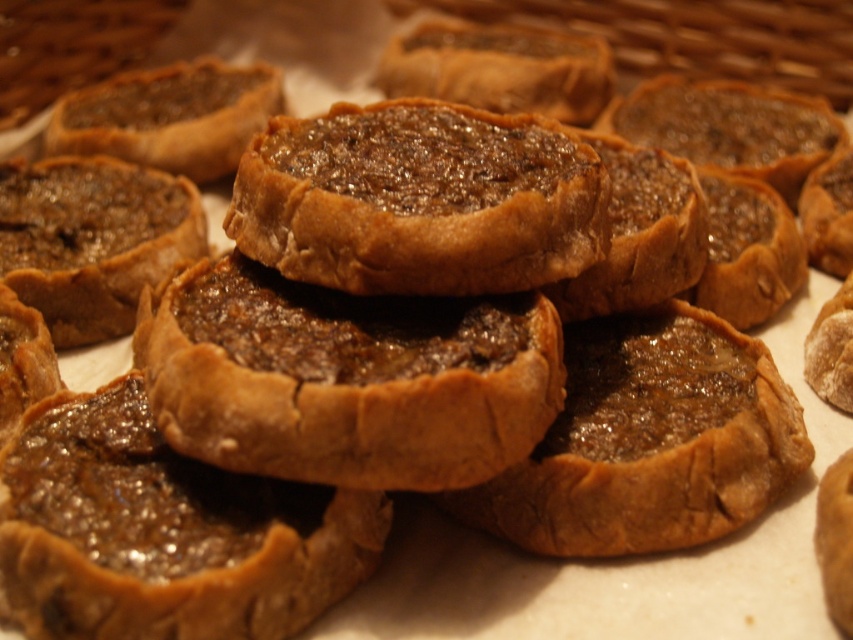
Between brown crumbly tart at center and brown crumbly pastry at center, which one appears on the right side from the viewer's perspective?

brown crumbly pastry at center is more to the right.

In the scene shown: Does brown crumbly tart at center have a smaller size compared to brown crumbly pastry at center?

Yes, brown crumbly tart at center is smaller than brown crumbly pastry at center.

Find the location of a particular element. brown crumbly tart at center is located at coordinates (419, 200).

Where is `brown crumbly tart at center`? brown crumbly tart at center is located at coordinates (419, 200).

Is point (312, 333) positioned after point (581, 552)?

No, (312, 333) is closer to viewer.

You are a GUI agent. You are given a task and a screenshot of the screen. Output one action in this format:
    pyautogui.click(x=<x>, y=<y>)
    Task: Click on the baked golden-brown tartlet at center
    This screenshot has width=853, height=640.
    Given the screenshot: What is the action you would take?
    pyautogui.click(x=346, y=378)

Is shiny brown pastry at center above brown crumbly tart at center?

No, shiny brown pastry at center is not above brown crumbly tart at center.

Does shiny brown pastry at center appear on the right side of brown crumbly tart at center?

No, shiny brown pastry at center is not to the right of brown crumbly tart at center.

Who is more forward, (209,595) or (500,161)?

Positioned in front is point (209,595).

Image resolution: width=853 pixels, height=640 pixels. I want to click on shiny brown pastry at center, so click(164, 532).